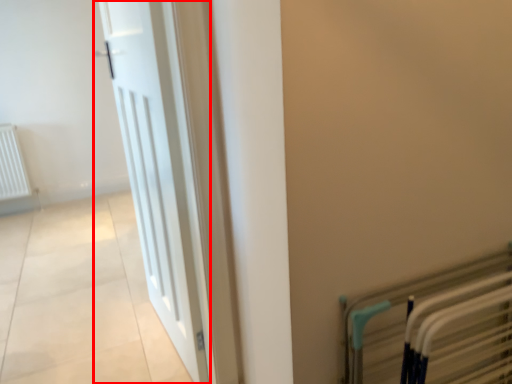
Question: From the image's perspective, where is door (annotated by the red box) located in relation to bed frame in the image?

Choices:
 (A) above
 (B) below

Answer: (A)